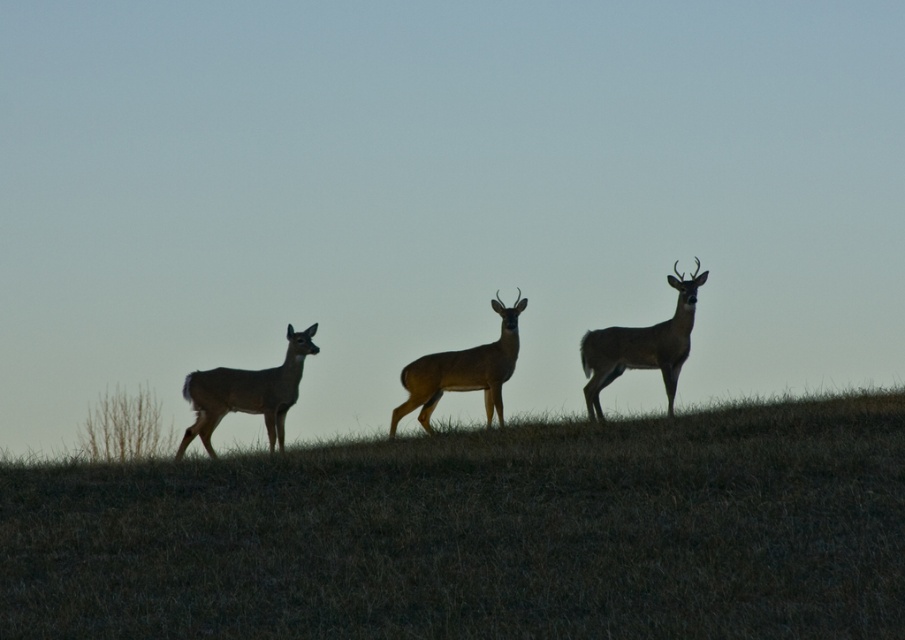
Between point (289, 348) and point (496, 404), which one is positioned in front?

Positioned in front is point (289, 348).

Which is behind, point (281, 378) or point (417, 376)?

The point (417, 376) is more distant.

Does point (311, 348) come farther from viewer compared to point (433, 356)?

No, it is in front of (433, 356).

Locate an element on the screen. Image resolution: width=905 pixels, height=640 pixels. silhouette velvet deer at left is located at coordinates (246, 394).

Is brown grassy at center to the right of silhouette velvet deer at left from the viewer's perspective?

Incorrect, brown grassy at center is not on the right side of silhouette velvet deer at left.

Can you confirm if brown grassy at center is wider than silhouette velvet deer at left?

No.

Is point (872, 547) positioned after point (265, 403)?

No, it is in front of (265, 403).

Where is `brown grassy at center`? The image size is (905, 640). brown grassy at center is located at coordinates (481, 532).

Is brown grassy at center below brown matte deer at center?

Yes, brown grassy at center is below brown matte deer at center.

Which is more to the right, brown grassy at center or brown matte deer at center?

brown matte deer at center

Is point (399, 600) farther from viewer compared to point (493, 378)?

No, it is not.

Locate an element on the screen. brown grassy at center is located at coordinates (481, 532).